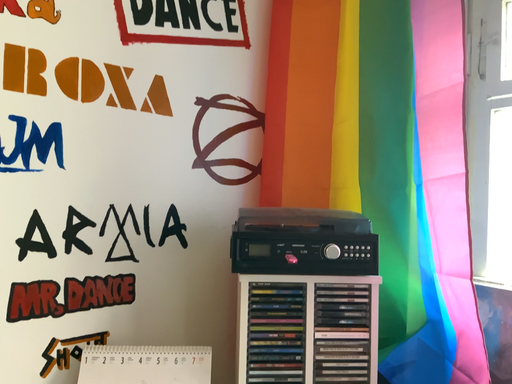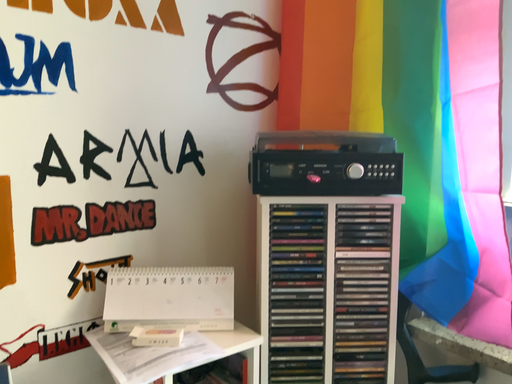
Question: How did the camera likely rotate when shooting the video?

Choices:
 (A) rotated downward
 (B) rotated upward

Answer: (A)